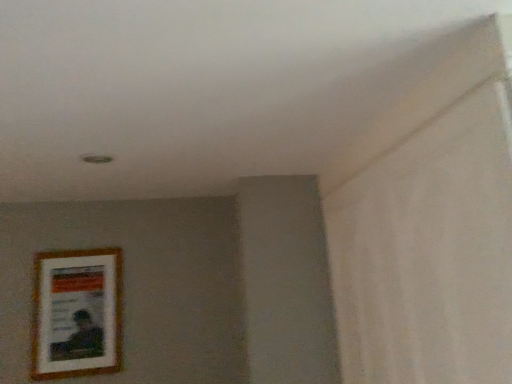
At what (x,y) coordinates should I click in order to perform the action: click on wooden picture frame at lower left. Please return your answer as a coordinate pair (x, y). Looking at the image, I should click on (76, 313).

Image resolution: width=512 pixels, height=384 pixels. What do you see at coordinates (76, 313) in the screenshot?
I see `wooden picture frame at lower left` at bounding box center [76, 313].

Where is `wooden picture frame at lower left`? This screenshot has width=512, height=384. wooden picture frame at lower left is located at coordinates (76, 313).